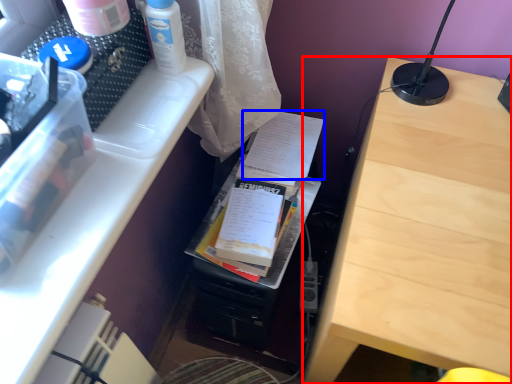
Question: Among these objects, which one is farthest to the camera, table (highlighted by a red box) or document (highlighted by a blue box)?

Choices:
 (A) table
 (B) document

Answer: (B)